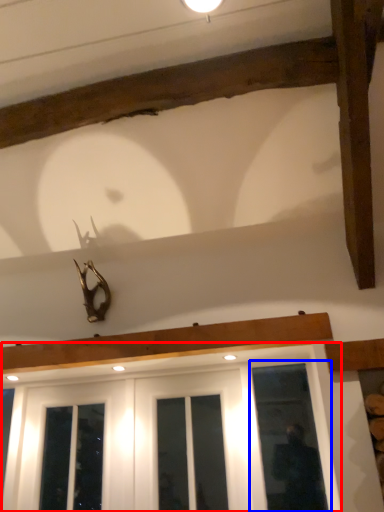
Question: Which point is closer to the camera, window (highlighted by a red box) or window (highlighted by a blue box)?

Choices:
 (A) window
 (B) window

Answer: (A)